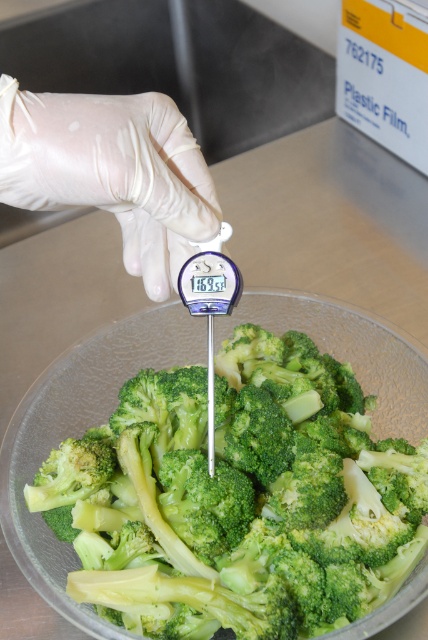
Between green matte broccoli at center and white latex glove at upper left, which one has more height?

green matte broccoli at center is taller.

Does green matte broccoli at center appear on the right side of white latex glove at upper left?

Indeed, green matte broccoli at center is positioned on the right side of white latex glove at upper left.

Which is in front, point (130, 625) or point (175, 221)?

Positioned in front is point (175, 221).

Where is `green matte broccoli at center`? The width and height of the screenshot is (428, 640). green matte broccoli at center is located at coordinates point(232,499).